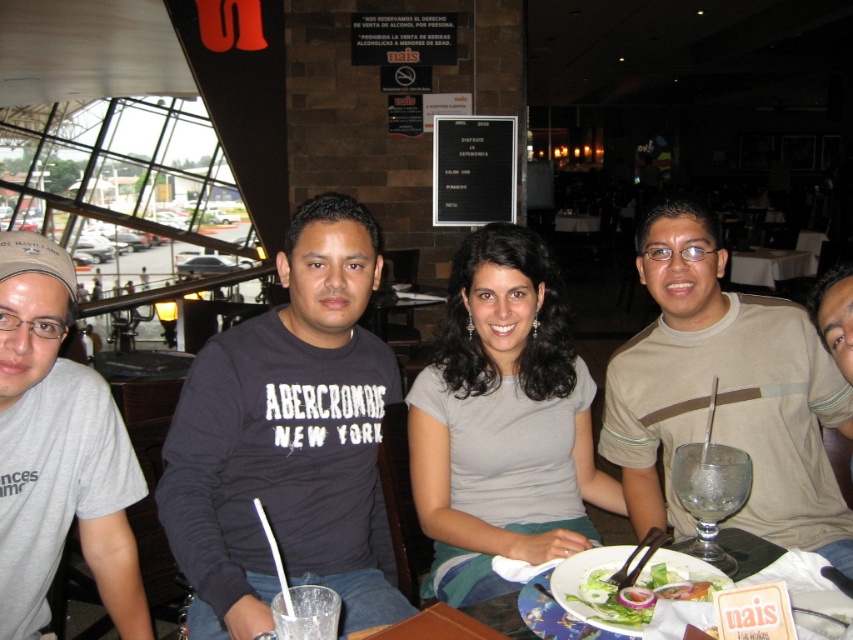
What is the 2D coordinate of the dark gray sweatshirt at center?

The dark gray sweatshirt at center is located at the 2D coordinate point of [288,440].

You are standing at the entrance of the restaurant and see the group seated at the table. There is a point marked at coordinates (288, 440). What object is located at that point?

The point at coordinates (288, 440) marks the dark gray sweatshirt at center.